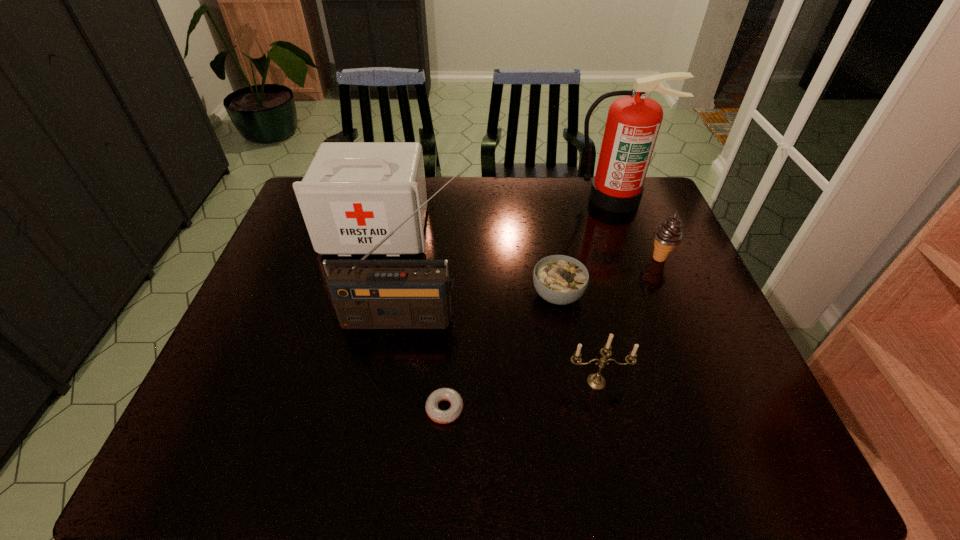
The height and width of the screenshot is (540, 960). I want to click on fire extinguisher, so click(x=633, y=122).

Where is `radio receiver`? The width and height of the screenshot is (960, 540). radio receiver is located at coordinates (364, 298).

Locate an element on the screen. This screenshot has height=540, width=960. the third tallest object is located at coordinates (353, 194).

Locate an element on the screen. This screenshot has height=540, width=960. the second nearest object is located at coordinates (595, 381).

Where is `icecream`? Image resolution: width=960 pixels, height=540 pixels. icecream is located at coordinates (668, 234).

Find the location of a particular element. The image size is (960, 540). soup bowl is located at coordinates (559, 279).

Where is `the nearest object`? The width and height of the screenshot is (960, 540). the nearest object is located at coordinates pyautogui.click(x=439, y=416).

Locate an element on the screen. This screenshot has height=540, width=960. doughnut is located at coordinates (439, 416).

At what (x,y) coordinates should I click in order to perform the action: click on vacant space situated 0.270m at the nozzle of the fire extinguisher. Please return your answer as a coordinate pair (x, y). Image resolution: width=960 pixels, height=540 pixels. Looking at the image, I should click on (642, 270).

Where is `vacant area situated 0.310m on the front-facing side of the radio receiver`? vacant area situated 0.310m on the front-facing side of the radio receiver is located at coordinates (381, 453).